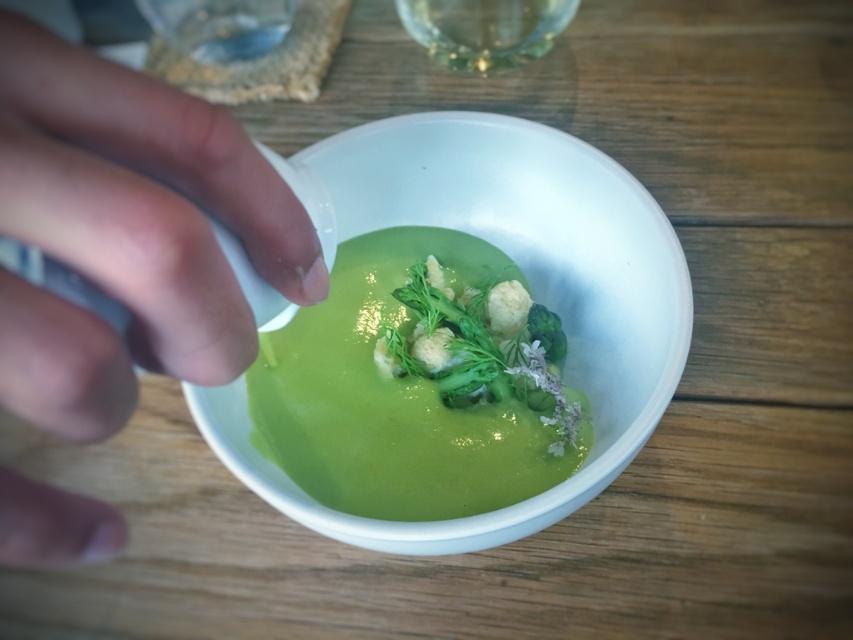
Question: Can you confirm if green creamy soup at center is thinner than green matte asparagus at center?

Choices:
 (A) yes
 (B) no

Answer: (B)

Question: Which of the following is the closest to the observer?

Choices:
 (A) green creamy soup at center
 (B) white glossy bowl at center

Answer: (B)

Question: From the image, what is the correct spatial relationship of matte white hand at left in relation to white glossy bowl at center?

Choices:
 (A) left
 (B) right

Answer: (A)

Question: Is matte white hand at left smaller than white glossy bowl at center?

Choices:
 (A) yes
 (B) no

Answer: (A)

Question: Which point is closer to the camera taking this photo?

Choices:
 (A) (207, 269)
 (B) (431, 509)
 (C) (643, 307)

Answer: (A)

Question: Considering the real-world distances, which object is farthest from the green matte asparagus at center?

Choices:
 (A) green creamy soup at center
 (B) white glossy bowl at center

Answer: (B)